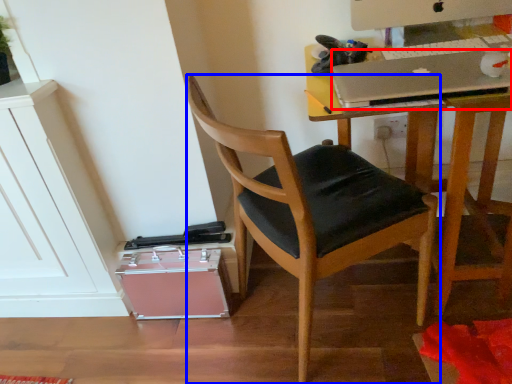
Question: Which object appears farthest to the camera in this image, laptop (highlighted by a red box) or chair (highlighted by a blue box)?

Choices:
 (A) laptop
 (B) chair

Answer: (A)